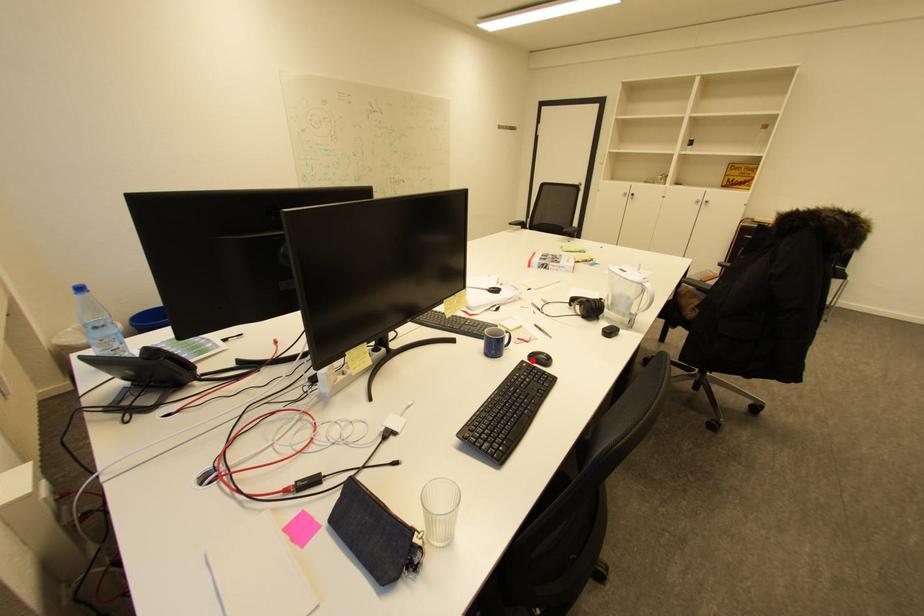
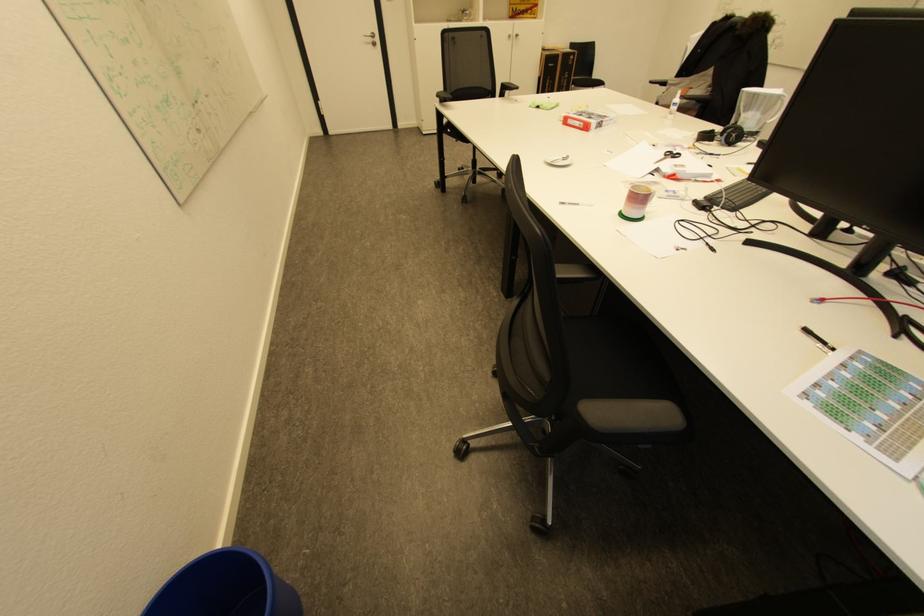
Question: I am providing you with two images of the same scene from different viewpoints. A red point is marked on the first image. At the location where the point appears in image 1, is it still visible in image 2?

Choices:
 (A) Yes
 (B) No

Answer: (B)